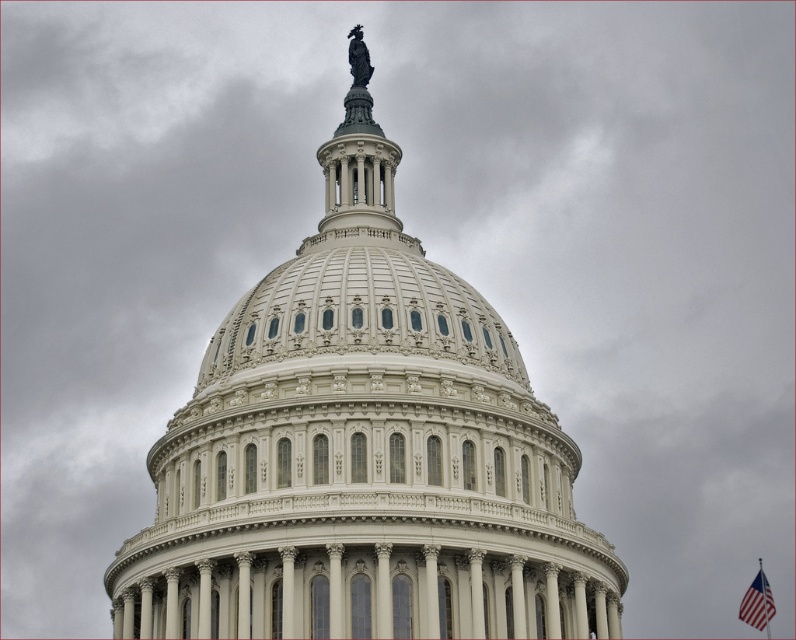
Does white marble dome at center have a lesser height compared to american flag at lower right?

No.

Looking at this image, does white marble dome at center appear on the right side of american flag at lower right?

In fact, white marble dome at center is to the left of american flag at lower right.

Between point (428, 589) and point (767, 596), which one is positioned in front?

Point (428, 589) is in front.

Locate an element on the screen. white marble dome at center is located at coordinates (363, 451).